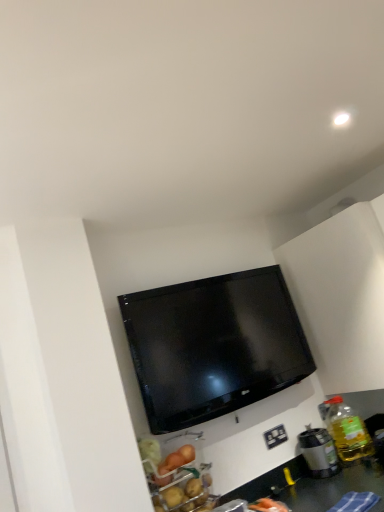
Question: Does metallic silver coffee maker at lower right come in front of translucent yellow bottle at right?

Choices:
 (A) yes
 (B) no

Answer: (A)

Question: From a real-world perspective, is metallic silver coffee maker at lower right physically above translucent yellow bottle at right?

Choices:
 (A) yes
 (B) no

Answer: (B)

Question: Does metallic silver coffee maker at lower right have a lesser height compared to translucent yellow bottle at right?

Choices:
 (A) no
 (B) yes

Answer: (B)

Question: Is metallic silver coffee maker at lower right aimed at translucent yellow bottle at right?

Choices:
 (A) yes
 (B) no

Answer: (B)

Question: Is metallic silver coffee maker at lower right turned away from translucent yellow bottle at right?

Choices:
 (A) yes
 (B) no

Answer: (B)

Question: Do you think white plastic electrical outlet at lower right is within translucent yellow bottle at right, or outside of it?

Choices:
 (A) outside
 (B) inside

Answer: (A)

Question: In the image, is white plastic electrical outlet at lower right positioned in front of or behind translucent yellow bottle at right?

Choices:
 (A) front
 (B) behind

Answer: (B)

Question: In terms of width, does white plastic electrical outlet at lower right look wider or thinner when compared to translucent yellow bottle at right?

Choices:
 (A) thin
 (B) wide

Answer: (A)

Question: Is point (269, 446) positioned closer to the camera than point (347, 418)?

Choices:
 (A) farther
 (B) closer

Answer: (B)

Question: Based on their sizes in the image, would you say white plastic electrical outlet at lower right is bigger or smaller than metallic silver coffee maker at lower right?

Choices:
 (A) big
 (B) small

Answer: (B)

Question: In terms of height, does white plastic electrical outlet at lower right look taller or shorter compared to metallic silver coffee maker at lower right?

Choices:
 (A) short
 (B) tall

Answer: (A)

Question: From the image's perspective, is white plastic electrical outlet at lower right positioned above or below metallic silver coffee maker at lower right?

Choices:
 (A) below
 (B) above

Answer: (B)

Question: In the image, is white plastic electrical outlet at lower right on the left side or the right side of metallic silver coffee maker at lower right?

Choices:
 (A) right
 (B) left

Answer: (B)

Question: Considering the positions of point (324, 437) and point (266, 444), is point (324, 437) closer or farther from the camera than point (266, 444)?

Choices:
 (A) closer
 (B) farther

Answer: (B)

Question: From the image's perspective, is metallic silver coffee maker at lower right positioned above or below white plastic electrical outlet at lower right?

Choices:
 (A) above
 (B) below

Answer: (B)